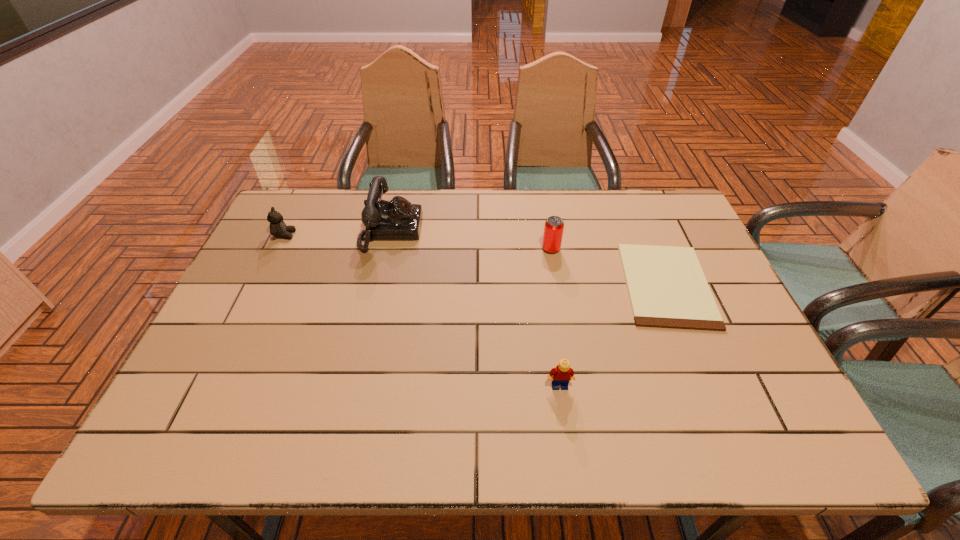
Locate an element on the screen. The height and width of the screenshot is (540, 960). free space between the rightmost object and the Lego is located at coordinates (612, 335).

You are a GUI agent. You are given a task and a screenshot of the screen. Output one action in this format:
    pyautogui.click(x=<x>, y=<y>)
    Task: Click on the empty space between the Lego and the tallest object
    This screenshot has height=540, width=960.
    Given the screenshot: What is the action you would take?
    pyautogui.click(x=475, y=308)

Where is `free area in between the teddy bear and the nearest object`? This screenshot has width=960, height=540. free area in between the teddy bear and the nearest object is located at coordinates (422, 310).

Find the location of a particular element. The image size is (960, 540). vacant space that is in between the teddy bear and the shortest object is located at coordinates (475, 260).

Identify the location of object that ranks as the fourth closest to the can. (278, 228).

Locate which object ranks second in proximity to the Lego. Please provide its 2D coordinates. Your answer should be formatted as a tuple, i.e. [(x, y)], where the tuple contains the x and y coordinates of a point satisfying the conditions above.

[(553, 230)]

This screenshot has width=960, height=540. I want to click on vacant space that satisfies the following two spatial constraints: 1. on the dial of the shortest object; 2. on the left side of the fourth object from right to left, so click(379, 285).

In order to click on free region that satisfies the following two spatial constraints: 1. on the dial of the tallest object; 2. on the left side of the shortest object in this screenshot , I will do click(379, 285).

You are a GUI agent. You are given a task and a screenshot of the screen. Output one action in this format:
    pyautogui.click(x=<x>, y=<y>)
    Task: Click on the vacant area that satisfies the following two spatial constraints: 1. on the dial of the can; 2. on the right side of the telephone
    
    Given the screenshot: What is the action you would take?
    pyautogui.click(x=387, y=249)

Where is `free region that satisfies the following two spatial constraints: 1. on the dial of the telephone; 2. on the left side of the shortest object`? The image size is (960, 540). free region that satisfies the following two spatial constraints: 1. on the dial of the telephone; 2. on the left side of the shortest object is located at coordinates (379, 285).